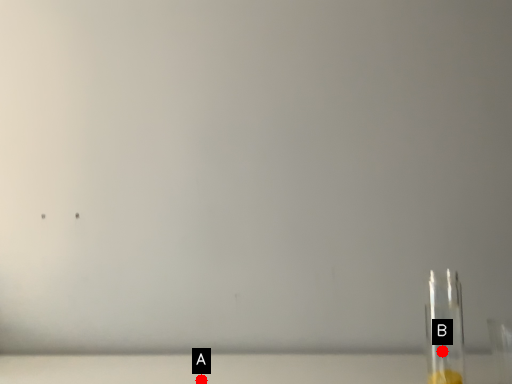
Question: Two points are circled on the image, labeled by A and B beside each circle. Which point is closer to the camera taking this photo?

Choices:
 (A) A is closer
 (B) B is closer

Answer: (A)